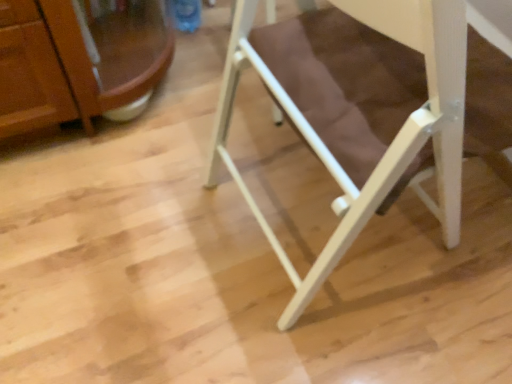
Find the location of `vacant space underneath matte brown cushion at center (from a real-world perspective)`. vacant space underneath matte brown cushion at center (from a real-world perspective) is located at coordinates (319, 226).